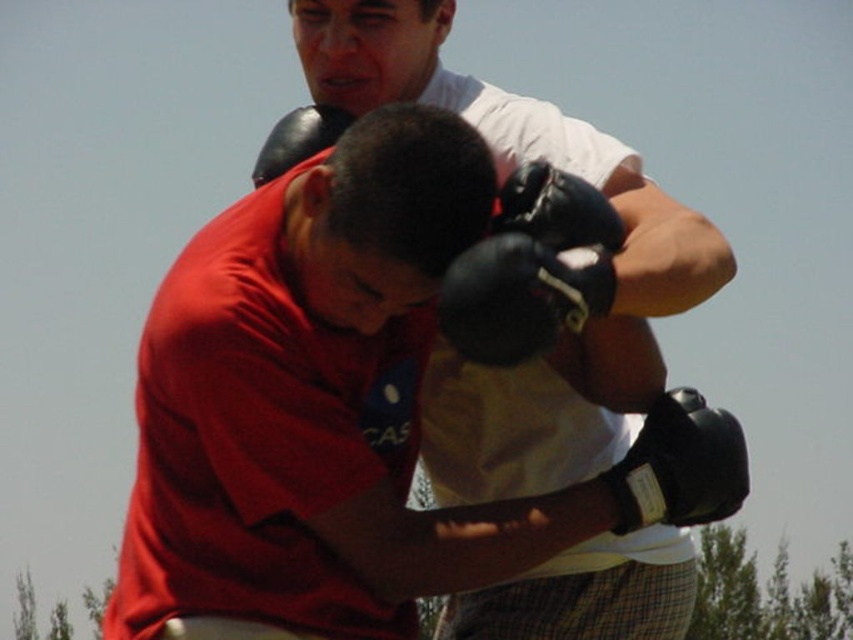
In the scene shown: You are a sports equipment inspector checking the positioning of the gloves in the boxing training image. Which glove, the matte black gloves at upper center or the black synthetic glove at lower right, is located to the left of the other?

The matte black gloves at upper center is positioned on the left side of black synthetic glove at lower right.

You are a coach observing a boxing training session. You notice the matte black gloves at upper center and the black synthetic glove at lower right. Can you determine if the distance between them is sufficient for a boxer to safely move from one to the other during a drill that requires a 10 feet distance?

The distance between the matte black gloves at upper center and the black synthetic glove at lower right is 8.79 feet, which is less than the required 10 feet. Therefore, the distance is insufficient for the boxer to safely move between them during the drill.